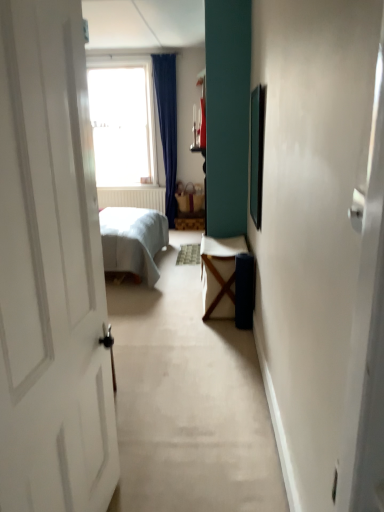
This screenshot has width=384, height=512. What do you see at coordinates (190, 207) in the screenshot?
I see `matte brown wicker basket at center` at bounding box center [190, 207].

Measure the distance between point (153, 93) and camera.

A distance of 6.39 meters exists between point (153, 93) and camera.

What is the approximate height of transparent glass window at upper center?

6.23 feet.

Image resolution: width=384 pixels, height=512 pixels. Identify the location of wooden table at center. (219, 274).

Which of these two, wooden table at center or matte brown wicker basket at center, stands shorter?

With less height is matte brown wicker basket at center.

Is wooden table at center thinner than matte brown wicker basket at center?

Incorrect, the width of wooden table at center is not less than that of matte brown wicker basket at center.

Is the position of wooden table at center less distant than that of matte brown wicker basket at center?

That is True.

Is point (233, 276) farther from viewer compared to point (176, 222)?

No, it is in front of (176, 222).

Does matte brown wicker basket at center have a greater width compared to transparent glass window at upper center?

In fact, matte brown wicker basket at center might be narrower than transparent glass window at upper center.

Between matte brown wicker basket at center and transparent glass window at upper center, which one has smaller size?

matte brown wicker basket at center is smaller.

Which object is more forward, matte brown wicker basket at center or transparent glass window at upper center?

transparent glass window at upper center is closer to the camera.

From a real-world perspective, is matte brown wicker basket at center positioned above or below wooden table at center?

In terms of real-world spatial position, matte brown wicker basket at center is above wooden table at center.

Is matte brown wicker basket at center bigger or smaller than wooden table at center?

Clearly, matte brown wicker basket at center is smaller in size than wooden table at center.

You are a GUI agent. You are given a task and a screenshot of the screen. Output one action in this format:
    pyautogui.click(x=<x>, y=<y>)
    Task: Click on the table beneath the matte brown wicker basket at center (from a real-world perspective)
    This screenshot has width=384, height=512.
    Given the screenshot: What is the action you would take?
    pyautogui.click(x=219, y=274)

Can you confirm if matte brown wicker basket at center is thinner than wooden table at center?

Correct, the width of matte brown wicker basket at center is less than that of wooden table at center.

Considering the relative positions of transparent glass window at upper center and matte brown wicker basket at center in the image provided, is transparent glass window at upper center to the left of matte brown wicker basket at center from the viewer's perspective?

Yes, transparent glass window at upper center is to the left of matte brown wicker basket at center.

Can you confirm if transparent glass window at upper center is bigger than matte brown wicker basket at center?

Yes.

Between transparent glass window at upper center and matte brown wicker basket at center, which one has less height?

matte brown wicker basket at center.

Is transparent glass window at upper center positioned in front of matte brown wicker basket at center?

Yes, transparent glass window at upper center is closer to the viewer.

Can you tell me how much transparent glass window at upper center and wooden table at center differ in facing direction?

The facing directions of transparent glass window at upper center and wooden table at center are 90 degrees apart.

Does transparent glass window at upper center have a greater width compared to wooden table at center?

Incorrect, the width of transparent glass window at upper center does not surpass that of wooden table at center.

Is transparent glass window at upper center far from wooden table at center?

transparent glass window at upper center is positioned a significant distance from wooden table at center.

Considering the sizes of objects transparent glass window at upper center and wooden table at center in the image provided, who is shorter, transparent glass window at upper center or wooden table at center?

With less height is wooden table at center.

Are wooden table at center and transparent glass window at upper center making contact?

wooden table at center and transparent glass window at upper center are not in contact.

Can transparent glass window at upper center be found inside wooden table at center?

No, transparent glass window at upper center is located outside of wooden table at center.

Considering the positions of objects wooden table at center and transparent glass window at upper center in the image provided, who is behind, wooden table at center or transparent glass window at upper center?

Positioned behind is transparent glass window at upper center.

In the scene shown: Does wooden table at center have a larger size compared to transparent glass window at upper center?

Actually, wooden table at center might be smaller than transparent glass window at upper center.

Identify the location of furniture above the wooden table at center (from the image's perspective). The image size is (384, 512). (190, 207).

Image resolution: width=384 pixels, height=512 pixels. Identify the location of furniture that appears on the right of transparent glass window at upper center. [190, 207].

Estimate the real-world distances between objects in this image. Which object is further from transparent glass window at upper center, wooden table at center or matte brown wicker basket at center?

wooden table at center is positioned further to the anchor transparent glass window at upper center.

Looking at the image, which one is located closer to wooden table at center, matte brown wicker basket at center or transparent glass window at upper center?

matte brown wicker basket at center is closer to wooden table at center.

Estimate the real-world distances between objects in this image. Which object is closer to matte brown wicker basket at center, wooden table at center or transparent glass window at upper center?

transparent glass window at upper center.

Considering their positions, is transparent glass window at upper center positioned closer to wooden table at center than matte brown wicker basket at center?

Result: Among the two, matte brown wicker basket at center is located nearer to wooden table at center.

Consider the image. Looking at the image, which one is located closer to matte brown wicker basket at center, transparent glass window at upper center or wooden table at center?

transparent glass window at upper center.

Consider the image. Estimate the real-world distances between objects in this image. Which object is further from transparent glass window at upper center, matte brown wicker basket at center or wooden table at center?

wooden table at center is further to transparent glass window at upper center.

You are a GUI agent. You are given a task and a screenshot of the screen. Output one action in this format:
    pyautogui.click(x=<x>, y=<y>)
    Task: Click on the window between wooden table at center and matte brown wicker basket at center in the front-back direction
    
    Given the screenshot: What is the action you would take?
    pyautogui.click(x=123, y=121)